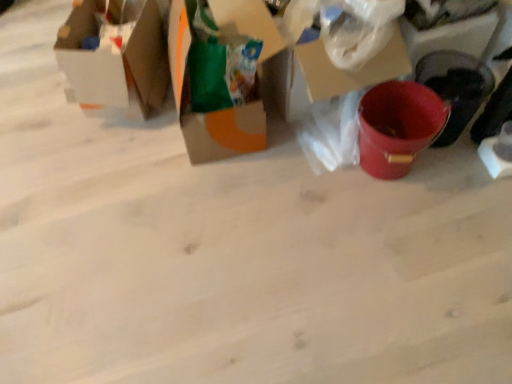
At what (x,y) coordinates should I click in order to perform the action: click on vacant area that is in front of matte cardboard box at upper left, which ranks as the second box in right-to-left order. Please return your answer as a coordinate pair (x, y). The image size is (512, 384). Looking at the image, I should click on (106, 159).